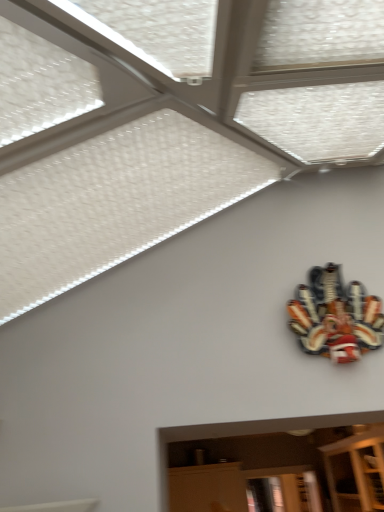
What is the approximate height of wooden cabinet at lower right?

wooden cabinet at lower right is 21.94 inches tall.

The width and height of the screenshot is (384, 512). What do you see at coordinates (356, 470) in the screenshot?
I see `wooden cabinet at lower right` at bounding box center [356, 470].

Image resolution: width=384 pixels, height=512 pixels. What are the coordinates of `wooden cabinet at lower right` in the screenshot? It's located at (356, 470).

This screenshot has height=512, width=384. Identify the location of wooden cabinet at lower right. (356, 470).